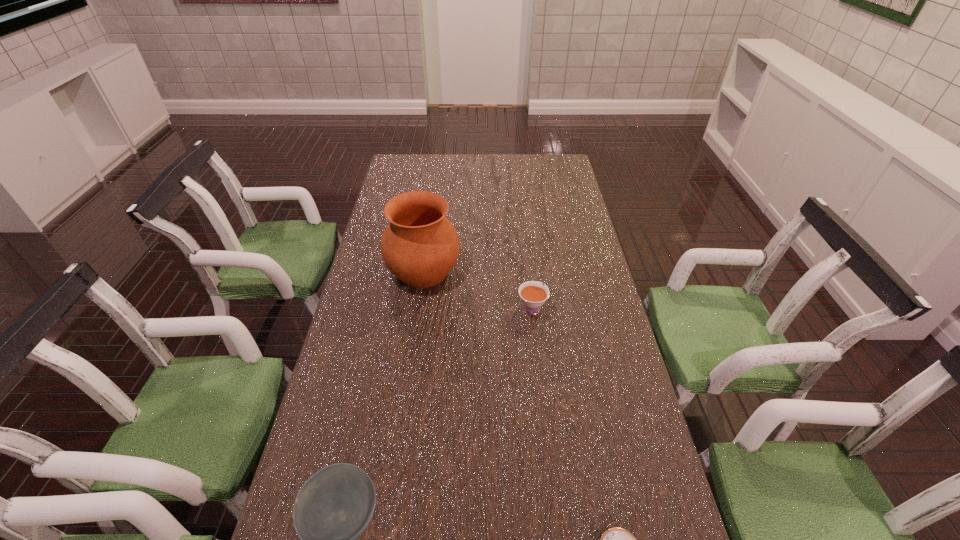
The height and width of the screenshot is (540, 960). In the image, there is a desktop. Find the location of `vacant space at the right edge`. vacant space at the right edge is located at coordinates (570, 280).

This screenshot has width=960, height=540. What are the coordinates of `vacant area at the far left corner` in the screenshot? It's located at (406, 166).

Where is `blank region between the left teacup and the tallest object`? blank region between the left teacup and the tallest object is located at coordinates [x=477, y=289].

I want to click on vacant space that's between the third object from left to right and the tallest object, so click(x=477, y=289).

Identify which object is located as the nearest to the bowl. Please provide its 2D coordinates. Your answer should be formatted as a tuple, i.e. [(x, y)], where the tuple contains the x and y coordinates of a point satisfying the conditions above.

[(615, 539)]

This screenshot has height=540, width=960. In order to click on the second closest object to the tallest object in this screenshot , I will do `click(333, 507)`.